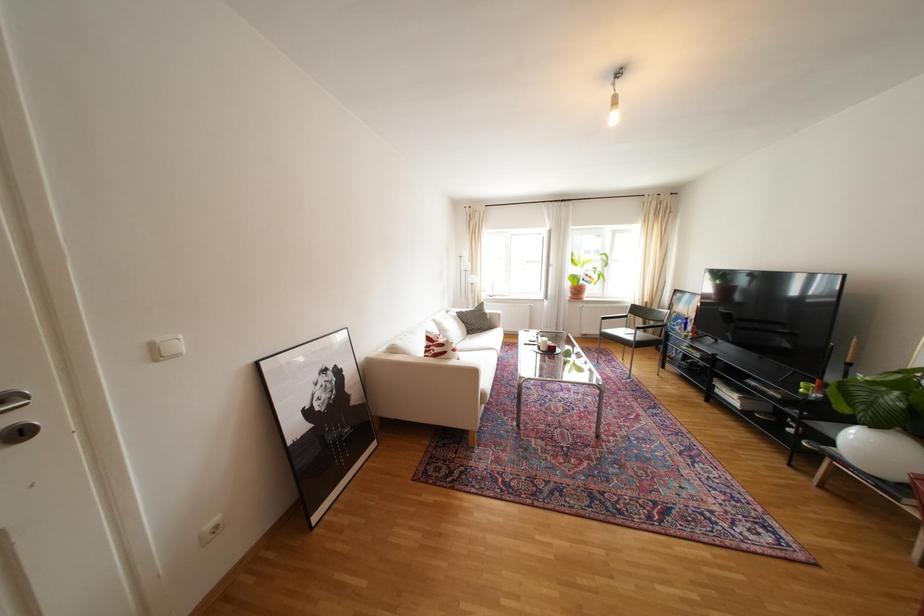
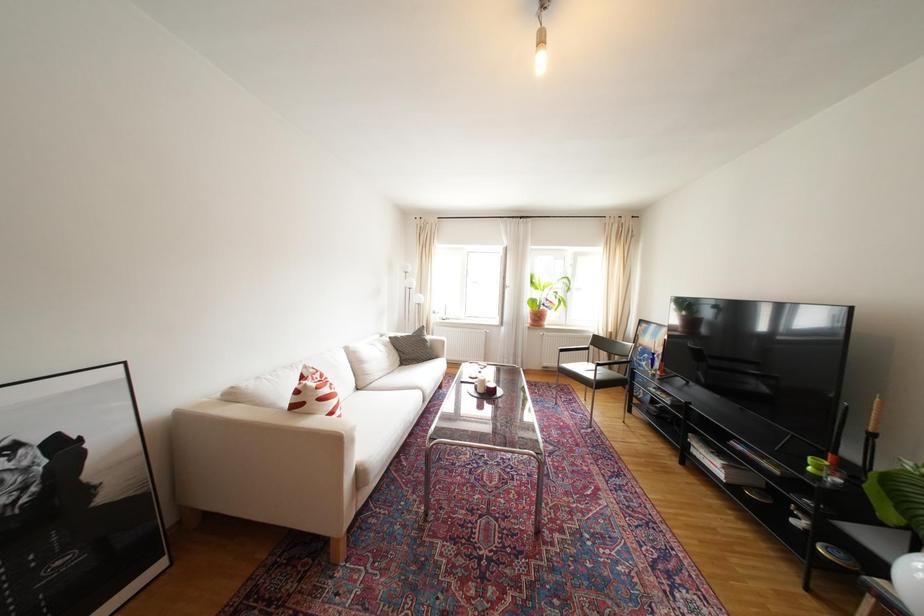
Question: How did the camera likely rotate?

Choices:
 (A) Left
 (B) Right
 (C) Up
 (D) Down

Answer: (C)